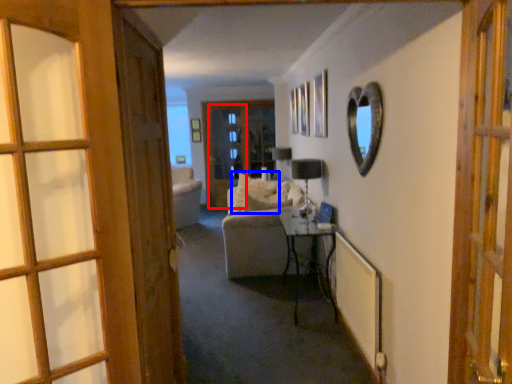
Question: Which of the following is the closest to the observer, screen door (highlighted by a red box) or pillow (highlighted by a blue box)?

Choices:
 (A) screen door
 (B) pillow

Answer: (B)